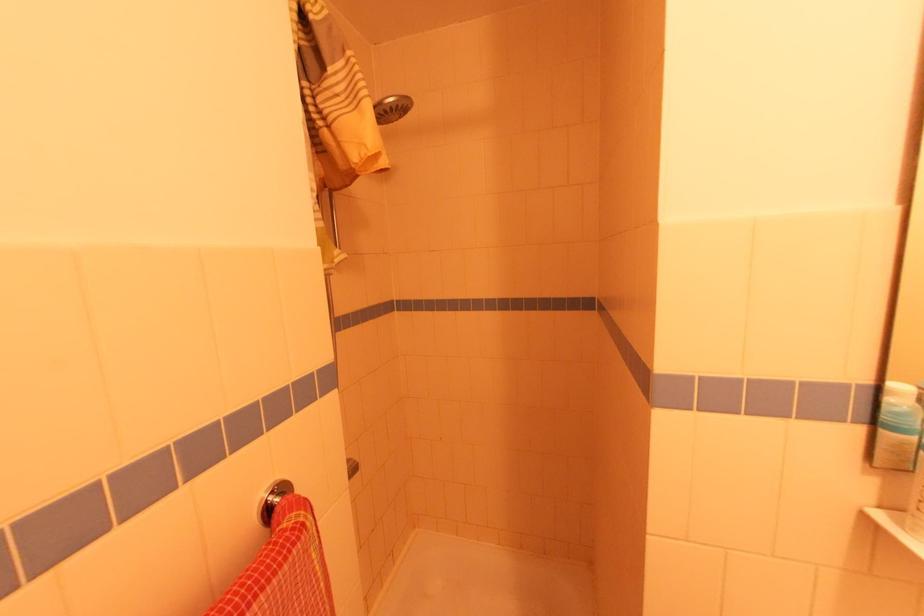
Find where to push the metal shower head. Please return your answer as a coordinate pair (x, y).

(392, 108)